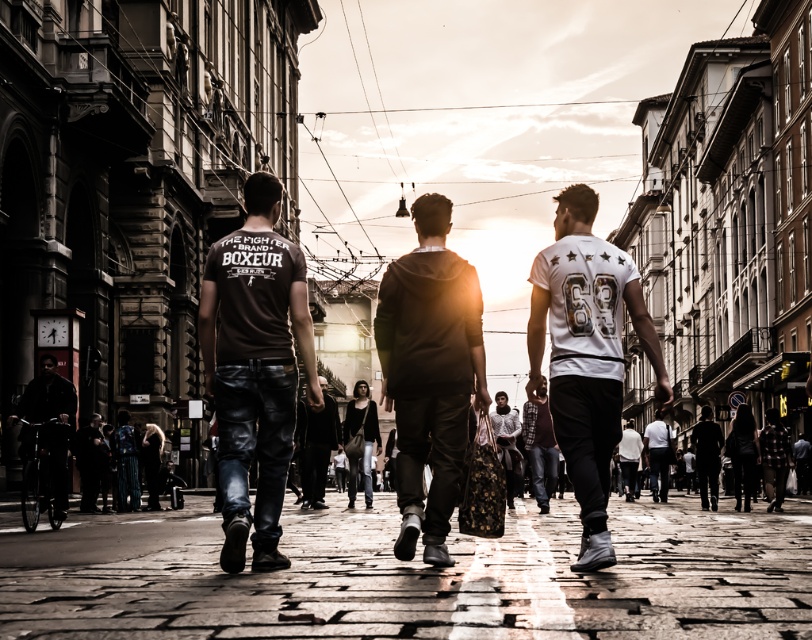
You are a photographer standing in the middle of the street. You want to take a photo of the dark matte jacket at left and the dark gray suit at lower right. Which one will appear larger in the photo?

The dark matte jacket at left will appear larger in the photo because it is taller than the dark gray suit at lower right.

Looking at this image, you are a photographer trying to capture a group photo of the dark matte jacket at left and the dark gray suit at lower right. Which person should you position closer to the camera to ensure both appear equally sized in the photo?

Since the dark matte jacket at left is wider than the dark gray suit at lower right, you should position the dark gray suit at lower right closer to the camera so that both appear equally sized in the photo.